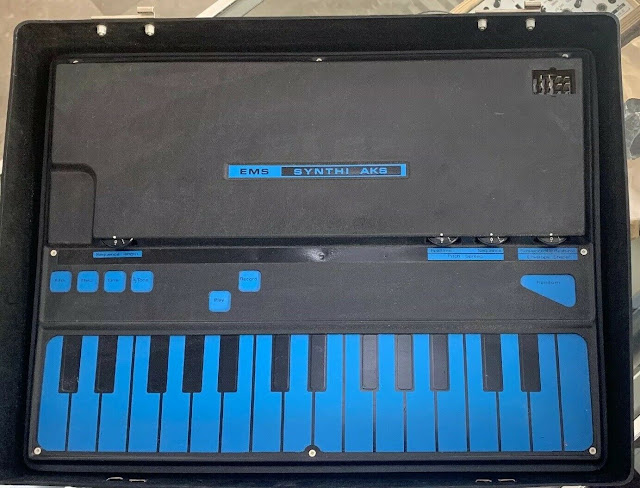
The image size is (640, 488). I want to click on synthesizer, so click(349, 206).